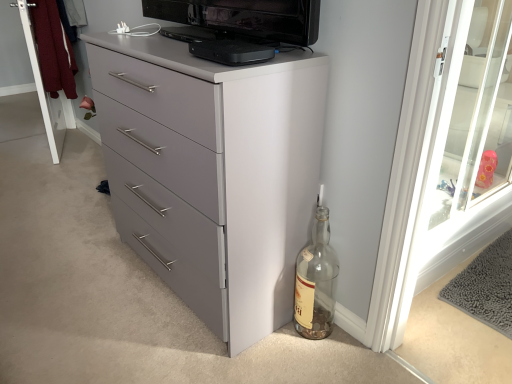
Where is `free space to the left of clear glass bottle at lower right`? free space to the left of clear glass bottle at lower right is located at coordinates (269, 342).